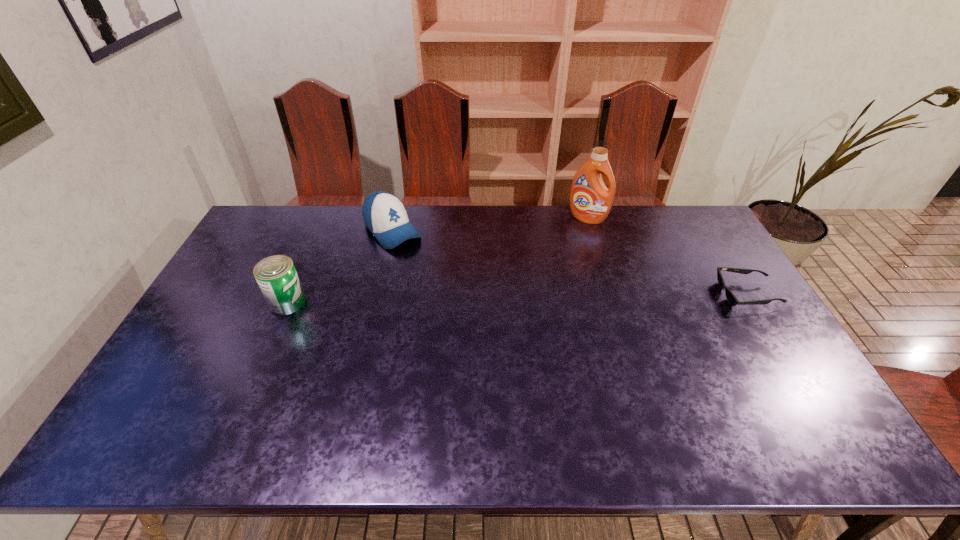
This screenshot has height=540, width=960. What are the coordinates of `vacant space on the desktop that is between the leftmost object and the rightmost object and is positioned on the front-facing side of the baseball cap` in the screenshot? It's located at (457, 299).

At what (x,y) coordinates should I click in order to perform the action: click on vacant space on the desktop that is between the leftmost object and the sunglasses and is positioned on the front-facing side of the second object from right to left. Please return your answer as a coordinate pair (x, y). The image size is (960, 540). Looking at the image, I should click on (541, 298).